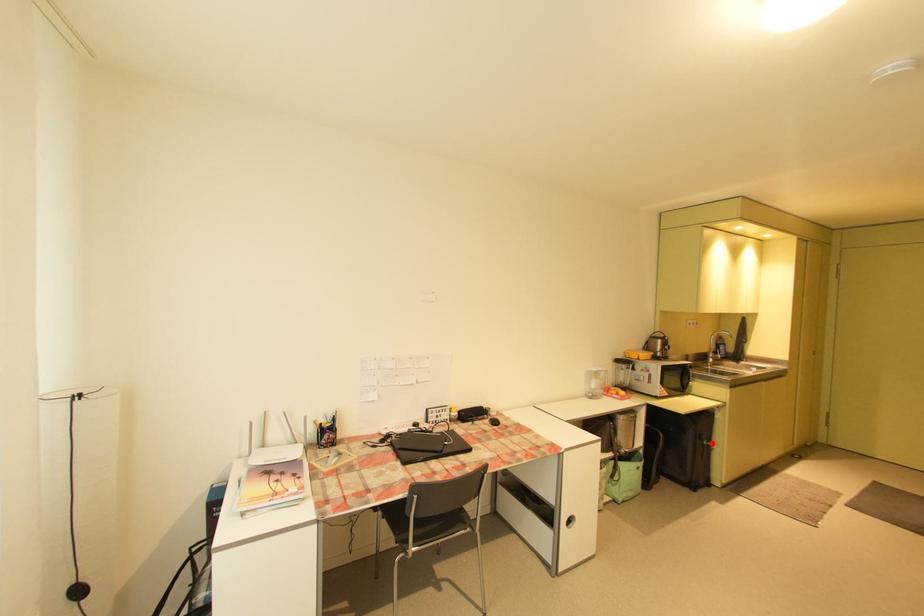
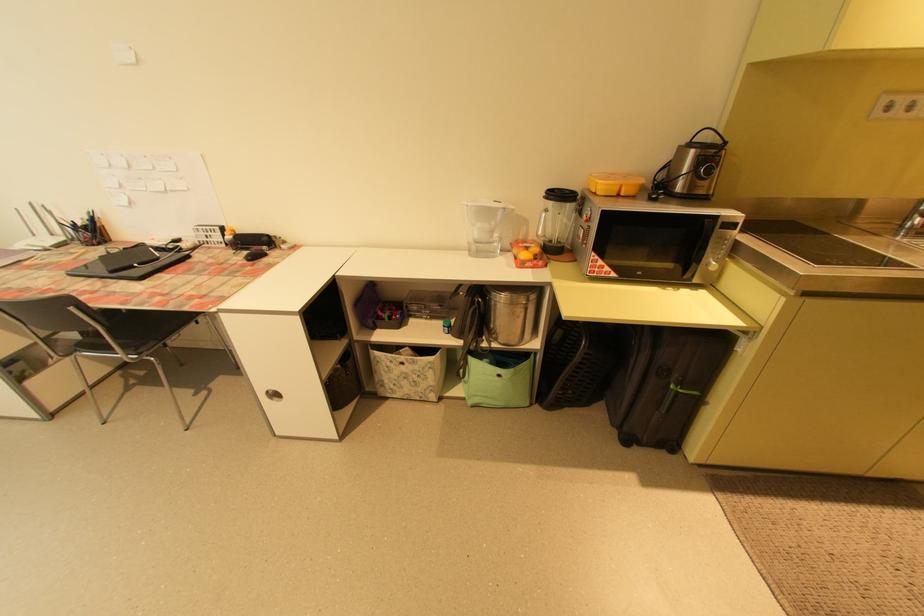
Find the pixel in the second image that matches the highlighted location in the first image.

(678, 387)